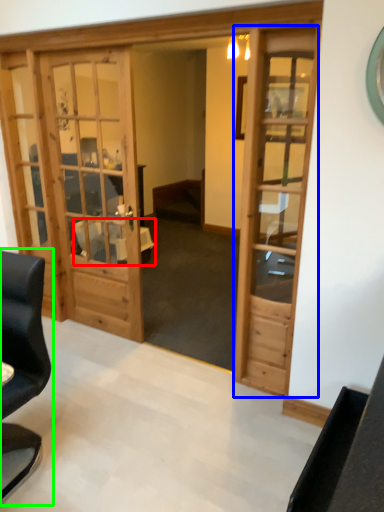
Question: Which is farther away from table (highlighted by a red box)? door (highlighted by a blue box) or chair (highlighted by a green box)?

Choices:
 (A) door
 (B) chair

Answer: (B)